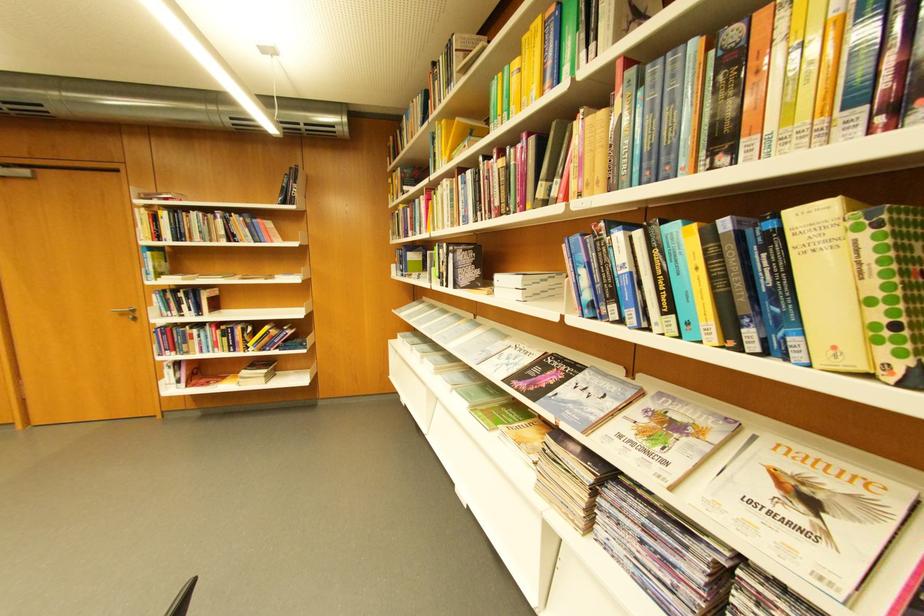
Find where to lift the black hardcover book. Please return your answer as a coordinate pair (x, y).

(465, 265)